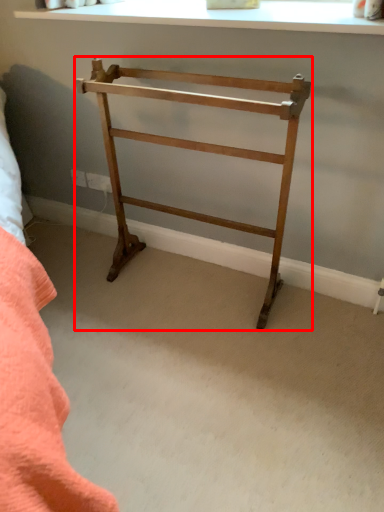
Question: From the image's perspective, what is the correct spatial relationship of furniture (annotated by the red box) in relation to window?

Choices:
 (A) below
 (B) above

Answer: (A)